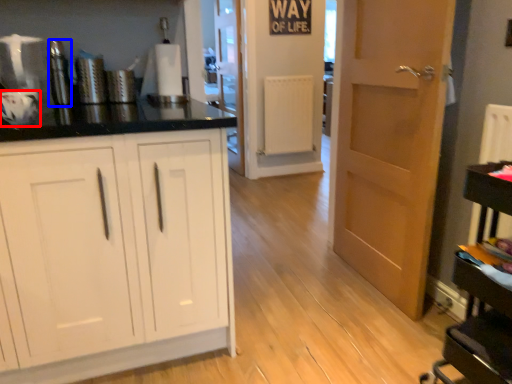
Question: Which object is further to the camera taking this photo, appliance (highlighted by a red box) or appliance (highlighted by a blue box)?

Choices:
 (A) appliance
 (B) appliance

Answer: (B)